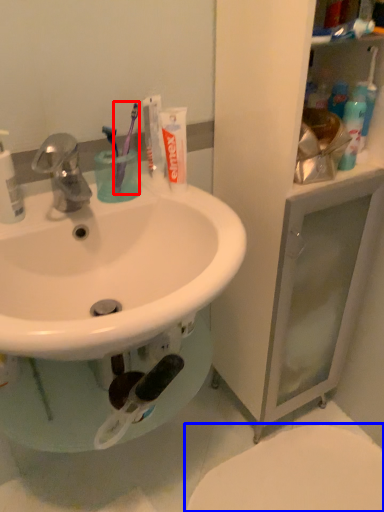
Question: Among these objects, which one is nearest to the camera, toothbrush (highlighted by a red box) or toilet (highlighted by a blue box)?

Choices:
 (A) toothbrush
 (B) toilet

Answer: (A)